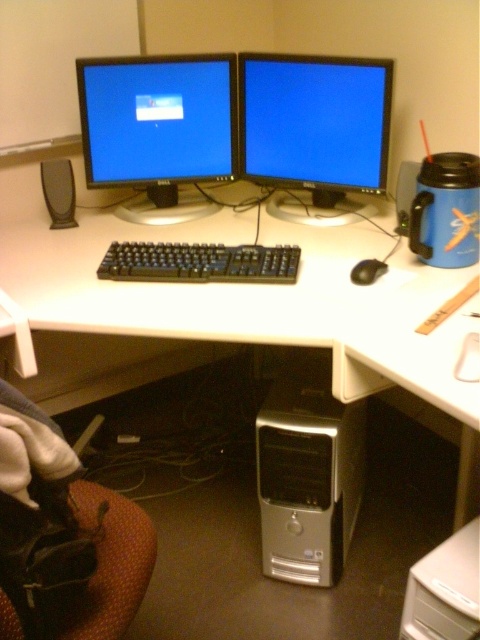
You are setting up a new monitor on the desk. The new monitor will be placed to the right of the black matte speaker at left. Where should you place the new monitor?

The new monitor should be placed to the right of the black matte speaker at left, which is located at point (59,192). Since the speaker is on the left side, placing the monitor to its right would align it appropriately on the desk.

You are setting up a new monitor stand and need to know the height difference between the matte black monitor at center and the black matte speaker at left. Which one is taller?

The matte black monitor at center is much taller than the black matte speaker at left.